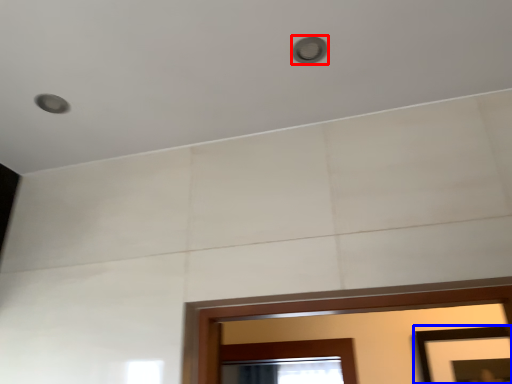
Question: Which point is further to the camera, light (highlighted by a red box) or picture frame (highlighted by a blue box)?

Choices:
 (A) light
 (B) picture frame

Answer: (B)